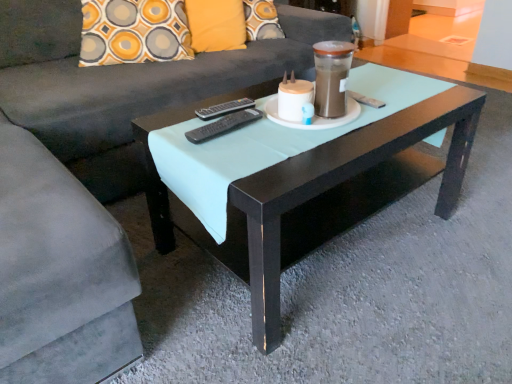
Where is `vacant space that is to the left of transparent glass beverage at center`? The image size is (512, 384). vacant space that is to the left of transparent glass beverage at center is located at coordinates (254, 124).